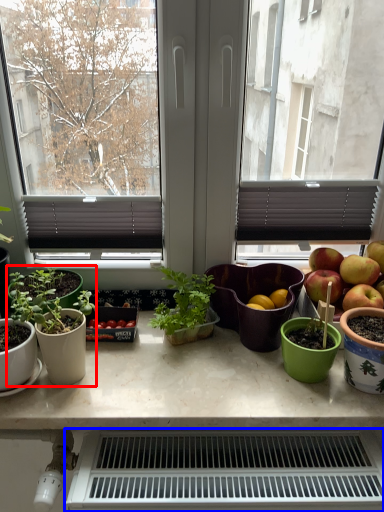
Question: Which point is further to the camera, houseplant (highlighted by a red box) or appliance (highlighted by a blue box)?

Choices:
 (A) houseplant
 (B) appliance

Answer: (A)